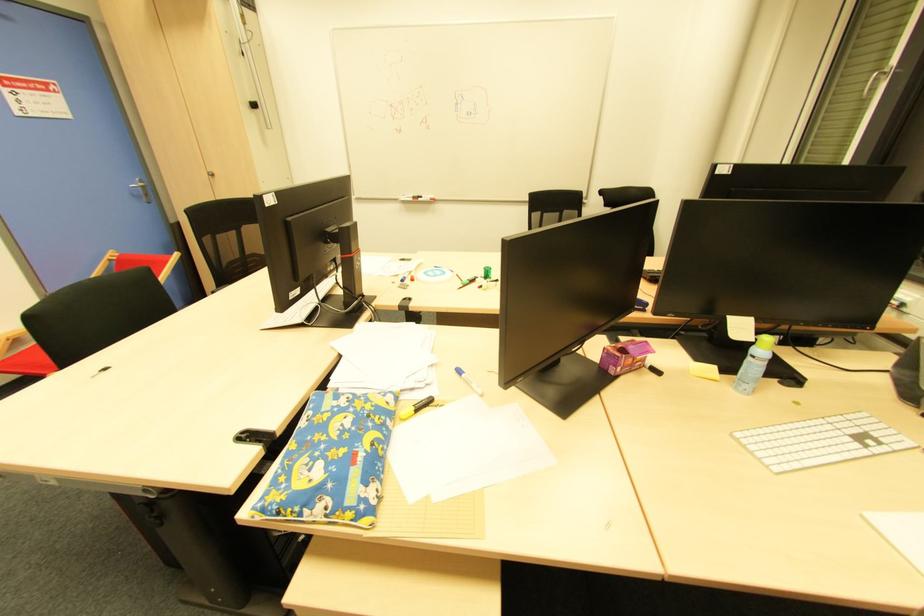
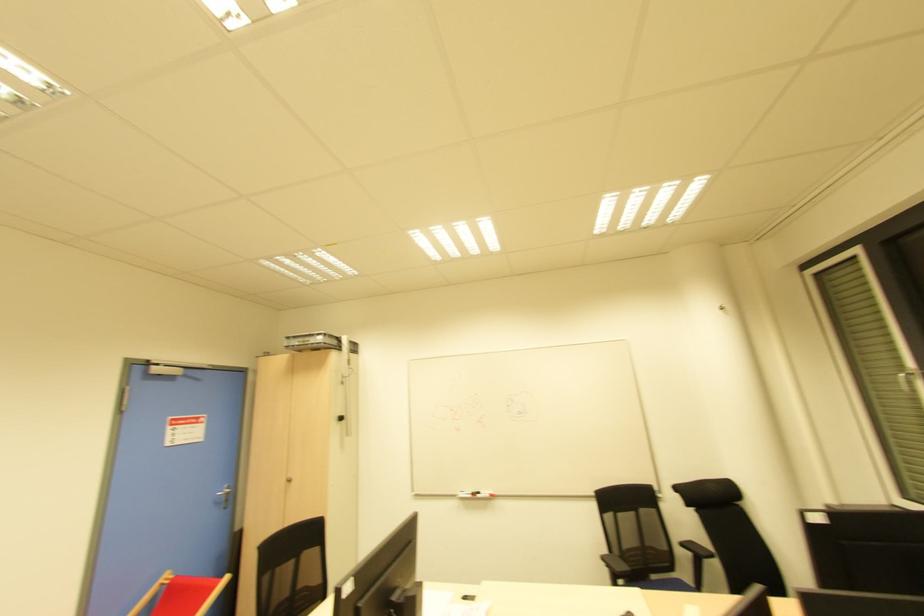
In the second image, find the point that corresponds to pixel 419 200 in the first image.

(478, 496)